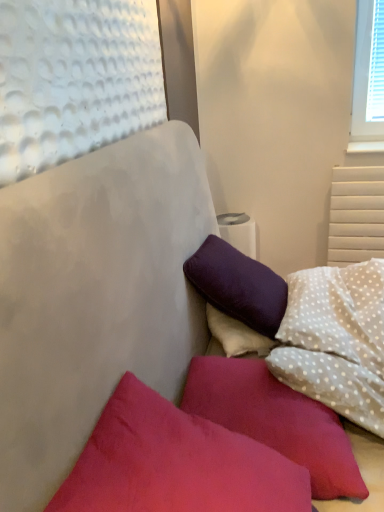
Question: From a real-world perspective, does matte pink pillow at lower left, which is the 2th pillow in back-to-front order, sit lower than suede-like red pillow at lower center, which is the 3th pillow from back to front?

Choices:
 (A) yes
 (B) no

Answer: (A)

Question: Is matte pink pillow at lower left, which is the 2th pillow in back-to-front order, directly adjacent to suede-like red pillow at lower center, marked as the first pillow in a front-to-back arrangement?

Choices:
 (A) yes
 (B) no

Answer: (B)

Question: Does matte pink pillow at lower left, which is the 2th pillow in back-to-front order, appear on the right side of suede-like red pillow at lower center, which is the 3th pillow from back to front?

Choices:
 (A) no
 (B) yes

Answer: (B)

Question: Considering the relative sizes of matte pink pillow at lower left, which is the 2th pillow in back-to-front order, and suede-like red pillow at lower center, marked as the first pillow in a front-to-back arrangement, in the image provided, is matte pink pillow at lower left, which is the 2th pillow in back-to-front order, taller than suede-like red pillow at lower center, marked as the first pillow in a front-to-back arrangement,?

Choices:
 (A) no
 (B) yes

Answer: (A)

Question: Is matte pink pillow at lower left, which is the 2th pillow in back-to-front order, closer to camera compared to suede-like red pillow at lower center, marked as the first pillow in a front-to-back arrangement?

Choices:
 (A) yes
 (B) no

Answer: (B)

Question: Is matte pink pillow at lower left, which is the 2th pillow in back-to-front order, located outside suede-like red pillow at lower center, marked as the first pillow in a front-to-back arrangement?

Choices:
 (A) no
 (B) yes

Answer: (B)

Question: Could you tell me if suede-like red pillow at lower center, which is the 3th pillow from back to front, is turned towards matte pink pillow at lower left, the 2th pillow positioned from the front?

Choices:
 (A) no
 (B) yes

Answer: (A)

Question: Considering the relative sizes of suede-like red pillow at lower center, which is the 3th pillow from back to front, and matte pink pillow at lower left, the 2th pillow positioned from the front, in the image provided, is suede-like red pillow at lower center, which is the 3th pillow from back to front, bigger than matte pink pillow at lower left, the 2th pillow positioned from the front,?

Choices:
 (A) yes
 (B) no

Answer: (A)

Question: Is suede-like red pillow at lower center, marked as the first pillow in a front-to-back arrangement, wider than matte pink pillow at lower left, the 2th pillow positioned from the front?

Choices:
 (A) yes
 (B) no

Answer: (A)

Question: Is suede-like red pillow at lower center, which is the 3th pillow from back to front, turned away from matte pink pillow at lower left, which is the 2th pillow in back-to-front order?

Choices:
 (A) yes
 (B) no

Answer: (B)

Question: From the image's perspective, is suede-like red pillow at lower center, marked as the first pillow in a front-to-back arrangement, above matte pink pillow at lower left, the 2th pillow positioned from the front?

Choices:
 (A) yes
 (B) no

Answer: (A)

Question: From a real-world perspective, does suede-like red pillow at lower center, marked as the first pillow in a front-to-back arrangement, stand above matte pink pillow at lower left, which is the 2th pillow in back-to-front order?

Choices:
 (A) yes
 (B) no

Answer: (A)

Question: Can you confirm if white dotted fabric pillow at upper right, which is counted as the 1th pillow, starting from the back, is shorter than suede-like red pillow at lower center, which is the 3th pillow from back to front?

Choices:
 (A) no
 (B) yes

Answer: (B)